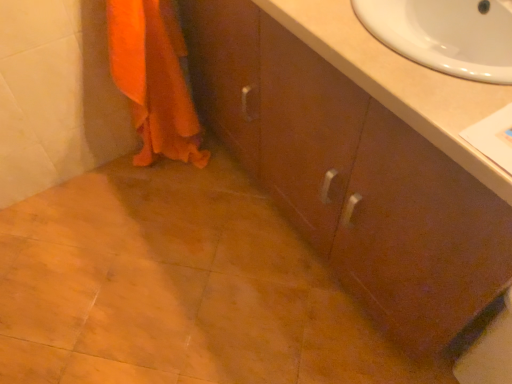
What do you see at coordinates (353, 171) in the screenshot? I see `matte brown cabinet at center` at bounding box center [353, 171].

The height and width of the screenshot is (384, 512). What do you see at coordinates (154, 79) in the screenshot? I see `orange fabric towel at lower left` at bounding box center [154, 79].

Identify the location of matte brown cabinet at center. The image size is (512, 384). pos(353,171).

Would you say orange fabric towel at lower left is inside or outside matte brown cabinet at center?

orange fabric towel at lower left lies outside matte brown cabinet at center.

Which is in front, point (143, 155) or point (415, 266)?

The point (415, 266) is more forward.

From the picture: Considering their positions, is orange fabric towel at lower left located in front of or behind matte brown cabinet at center?

orange fabric towel at lower left is positioned farther from the viewer than matte brown cabinet at center.

What's the angular difference between orange fabric towel at lower left and matte brown cabinet at center's facing directions?

There is a 89.5-degree angle between the facing directions of orange fabric towel at lower left and matte brown cabinet at center.

Is orange fabric towel at lower left spatially inside beige laminate sink at upper right, or outside of it?

orange fabric towel at lower left exists outside the volume of beige laminate sink at upper right.

Which point is more forward, (124, 22) or (468, 164)?

Positioned in front is point (468, 164).

Is orange fabric towel at lower left taller than beige laminate sink at upper right?

Correct, orange fabric towel at lower left is much taller as beige laminate sink at upper right.

Based on the photo, from a real-world perspective, between orange fabric towel at lower left and beige laminate sink at upper right, who is vertically lower?

orange fabric towel at lower left, from a real-world perspective.

Measure the distance from beige laminate sink at upper right to matte brown cabinet at center.

A distance of 9.11 inches exists between beige laminate sink at upper right and matte brown cabinet at center.

Does beige laminate sink at upper right have a greater width compared to matte brown cabinet at center?

In fact, beige laminate sink at upper right might be narrower than matte brown cabinet at center.

Is beige laminate sink at upper right beside matte brown cabinet at center?

No, beige laminate sink at upper right is not making contact with matte brown cabinet at center.

From a real-world perspective, is beige laminate sink at upper right physically above matte brown cabinet at center?

Yes, from a real-world perspective, beige laminate sink at upper right is on top of matte brown cabinet at center.

From their relative heights in the image, would you say beige laminate sink at upper right is taller or shorter than orange fabric towel at lower left?

Considering their sizes, beige laminate sink at upper right has less height than orange fabric towel at lower left.

Can you tell me how much beige laminate sink at upper right and orange fabric towel at lower left differ in facing direction?

There is a 90.6-degree angle between the facing directions of beige laminate sink at upper right and orange fabric towel at lower left.

Which is in front, point (484, 92) or point (110, 46)?

The point (484, 92) is in front.

Considering the positions of objects beige laminate sink at upper right and orange fabric towel at lower left in the image provided, who is in front, beige laminate sink at upper right or orange fabric towel at lower left?

beige laminate sink at upper right is closer to the camera.

From a real-world perspective, is matte brown cabinet at center above or below orange fabric towel at lower left?

Clearly, from a real-world perspective, matte brown cabinet at center is above orange fabric towel at lower left.

Is matte brown cabinet at center located outside orange fabric towel at lower left?

Indeed, matte brown cabinet at center is completely outside orange fabric towel at lower left.

Find the location of a particular element. bath towel on the left of matte brown cabinet at center is located at coordinates (154, 79).

Is matte brown cabinet at center in contact with orange fabric towel at lower left?

They are not placed beside each other.

Based on their positions, is matte brown cabinet at center located to the left or right of beige laminate sink at upper right?

In the image, matte brown cabinet at center appears on the left side of beige laminate sink at upper right.

Is beige laminate sink at upper right at the back of matte brown cabinet at center?

That's not correct — matte brown cabinet at center is not looking away from beige laminate sink at upper right.

Is matte brown cabinet at center positioned beyond the bounds of beige laminate sink at upper right?

matte brown cabinet at center lies outside beige laminate sink at upper right's area.

Image resolution: width=512 pixels, height=384 pixels. What are the coordinates of `bathroom cabinet in front of the orange fabric towel at lower left` in the screenshot? It's located at (353, 171).

Where is `counter top on the right of the orange fabric towel at lower left`? Image resolution: width=512 pixels, height=384 pixels. counter top on the right of the orange fabric towel at lower left is located at coordinates (400, 82).

From the image, which object appears to be nearer to beige laminate sink at upper right, matte brown cabinet at center or orange fabric towel at lower left?

Among the two, matte brown cabinet at center is located nearer to beige laminate sink at upper right.

Considering their positions, is orange fabric towel at lower left positioned further to matte brown cabinet at center than beige laminate sink at upper right?

orange fabric towel at lower left is further to matte brown cabinet at center.

When comparing their distances from orange fabric towel at lower left, does beige laminate sink at upper right or matte brown cabinet at center seem further?

Based on the image, beige laminate sink at upper right appears to be further to orange fabric towel at lower left.

In the scene shown: Based on their spatial positions, is beige laminate sink at upper right or orange fabric towel at lower left further from matte brown cabinet at center?

Based on the image, orange fabric towel at lower left appears to be further to matte brown cabinet at center.

From the image, which object appears to be farther from orange fabric towel at lower left, matte brown cabinet at center or beige laminate sink at upper right?

beige laminate sink at upper right is further to orange fabric towel at lower left.

Looking at the image, which one is located further to beige laminate sink at upper right, orange fabric towel at lower left or matte brown cabinet at center?

orange fabric towel at lower left is further to beige laminate sink at upper right.

Locate an element on the screen. The height and width of the screenshot is (384, 512). bathroom cabinet between orange fabric towel at lower left and beige laminate sink at upper right in the horizontal direction is located at coordinates (353, 171).